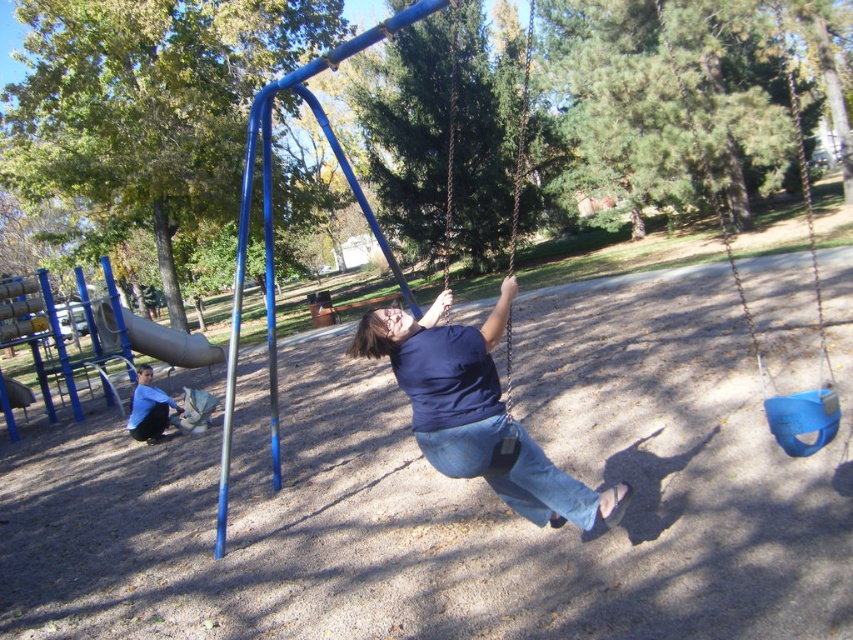
Between blue plastic swing at upper right and denim at center, which one has less height?

denim at center

Is blue plastic swing at upper right bigger than denim at center?

Yes.

Which is in front, point (763, 400) or point (502, 477)?

Point (502, 477)

This screenshot has width=853, height=640. In order to click on blue plastic swing at upper right in this screenshot , I will do `click(751, 316)`.

What do you see at coordinates (474, 410) in the screenshot? This screenshot has height=640, width=853. I see `dark blue fabric at center` at bounding box center [474, 410].

Who is more forward, (x=515, y=477) or (x=19, y=381)?

Point (x=515, y=477)

Find the location of `dark blue fabric at center`. dark blue fabric at center is located at coordinates (474, 410).

Between smooth gray slide at center-left and brushed metal slide at left, which one is positioned higher?

smooth gray slide at center-left is above.

Which of these two, smooth gray slide at center-left or brushed metal slide at left, stands shorter?

brushed metal slide at left

In order to click on smooth gray slide at center-left in this screenshot , I will do `click(170, 342)`.